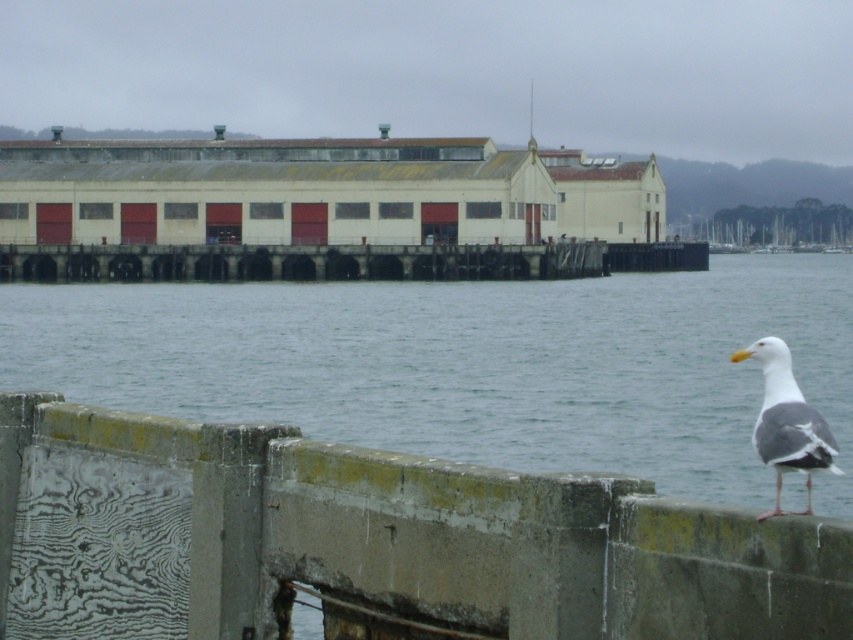
You are standing on the pier and see the clear water at lower center and the white feathered seagull at lower right. Which object is closer to you?

The white feathered seagull at lower right is closer to you because the clear water at lower center is positioned over it, indicating it is behind the seagull.

You are standing on the pier and see the clear water at lower center and the white feathered seagull at lower right. Which object is located to the right of the other?

The white feathered seagull at lower right is located to the right of the clear water at lower center.